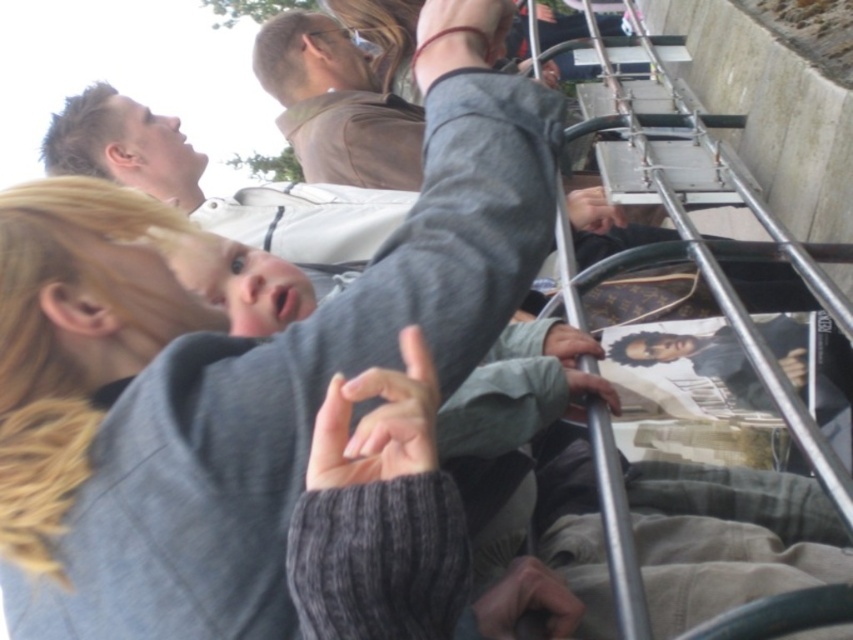
Question: Among these points, which one is farthest from the camera?

Choices:
 (A) (486, 593)
 (B) (318, 152)

Answer: (B)

Question: Which object appears farthest from the camera in this image?

Choices:
 (A) matte gray hand at upper center
 (B) matte gray wristband at upper center
 (C) matte brown shirt at upper center
 (D) gray fabric jacket at upper center

Answer: (C)

Question: Does gray fabric jacket at upper center appear on the left side of gray knitted sweater at center?

Choices:
 (A) yes
 (B) no

Answer: (A)

Question: Is matte brown shirt at upper center to the right of gray knitted sweater at center from the viewer's perspective?

Choices:
 (A) no
 (B) yes

Answer: (A)

Question: Among these objects, which one is farthest from the camera?

Choices:
 (A) matte gray wristband at upper center
 (B) matte brown shirt at upper center

Answer: (B)

Question: Is the position of matte brown shirt at upper center less distant than that of smooth gray hand at center?

Choices:
 (A) no
 (B) yes

Answer: (A)